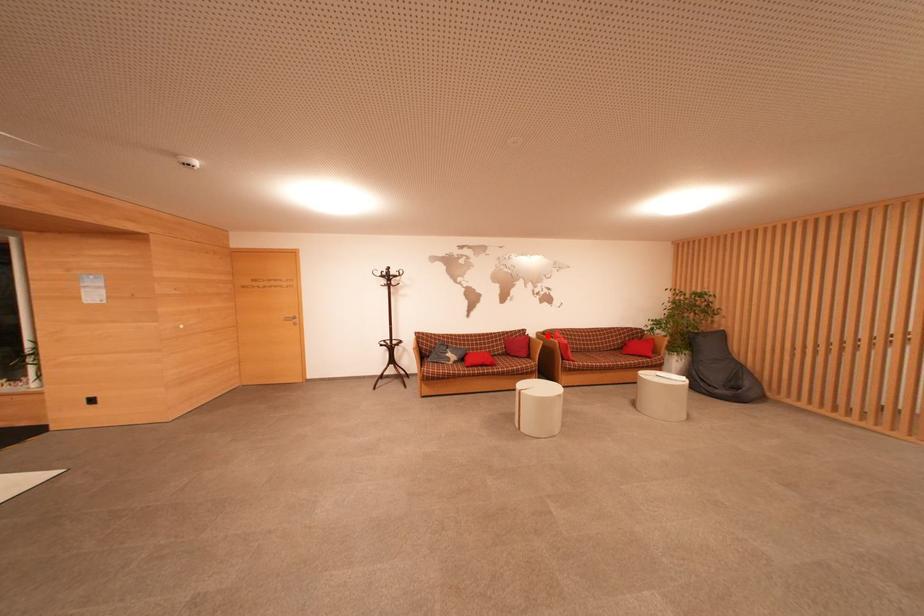
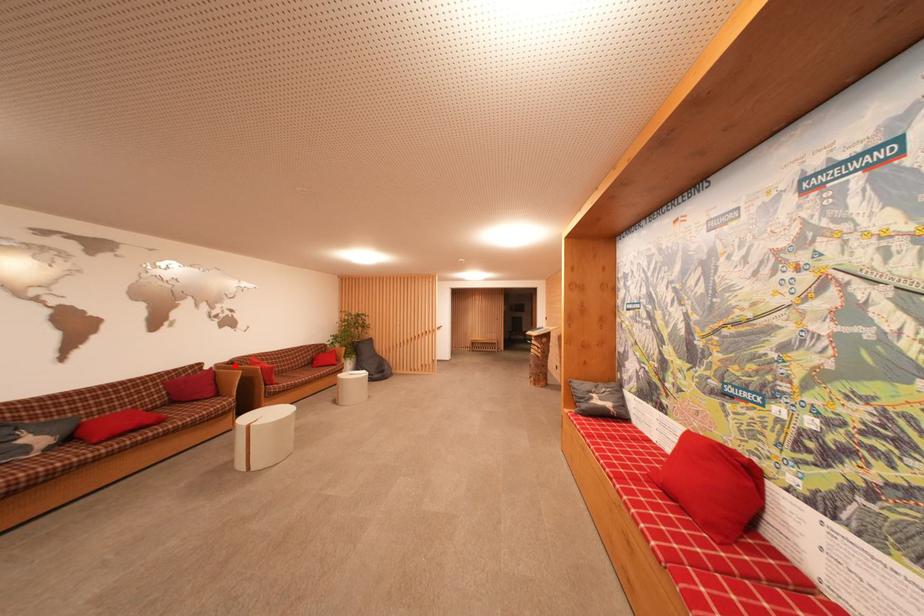
I am providing you with two images of the same scene from different viewpoints. A red point is marked on the first image and another point is marked on the second image. Do the highlighted points in image1 and image2 indicate the same real-world spot?

Yes